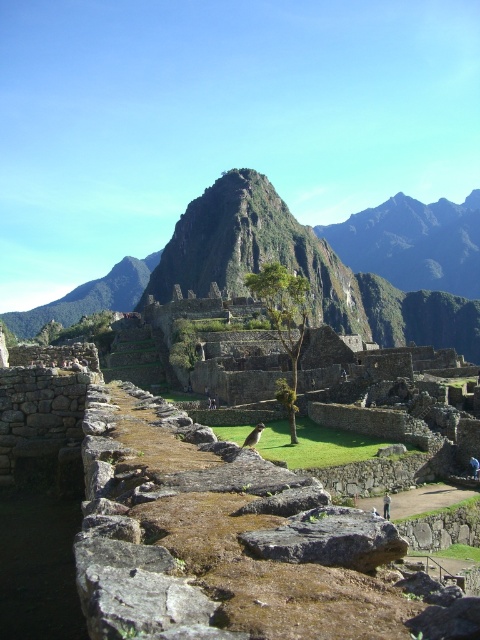
Does green grassy mountain at center appear under gray rough rock at center?

No.

Who is positioned more to the left, green grassy mountain at center or gray rough rock at center?

green grassy mountain at center

Which is in front, point (362, 321) or point (271, 544)?

Point (271, 544) is in front.

This screenshot has width=480, height=640. In order to click on green grassy mountain at center in this screenshot , I will do `click(268, 260)`.

Does gray rough rock at center lie in front of green leafy tree at center?

Yes, it is.

What are the coordinates of `gray rough rock at center` in the screenshot? It's located at (330, 540).

Can you confirm if green grassy mountain at center is positioned above green leafy tree at center?

Yes, green grassy mountain at center is above green leafy tree at center.

Which is in front, point (345, 282) or point (294, 438)?

Point (294, 438)

Between point (194, 264) and point (303, 316), which one is positioned in front?

Point (303, 316) is in front.

The width and height of the screenshot is (480, 640). Find the location of `green grassy mountain at center`. green grassy mountain at center is located at coordinates (268, 260).